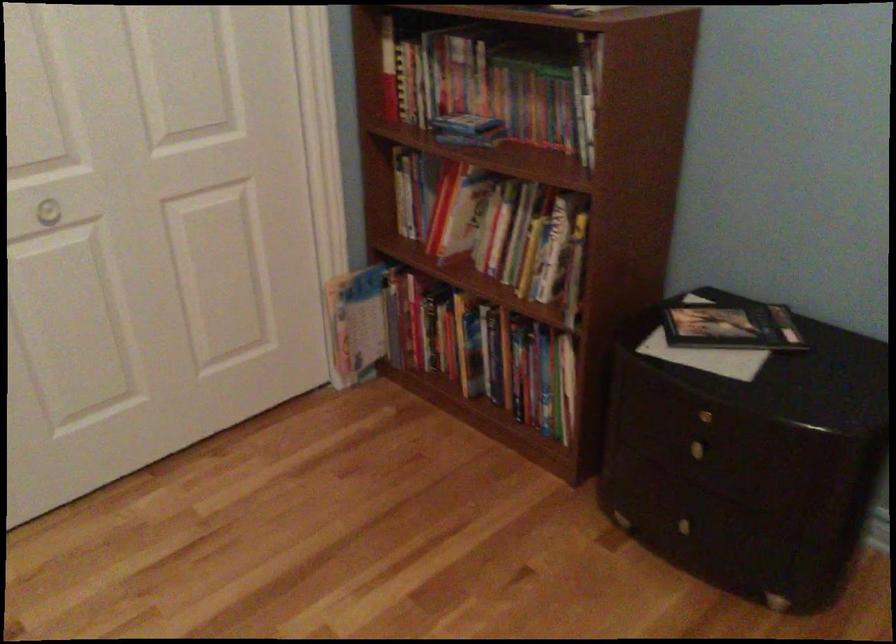
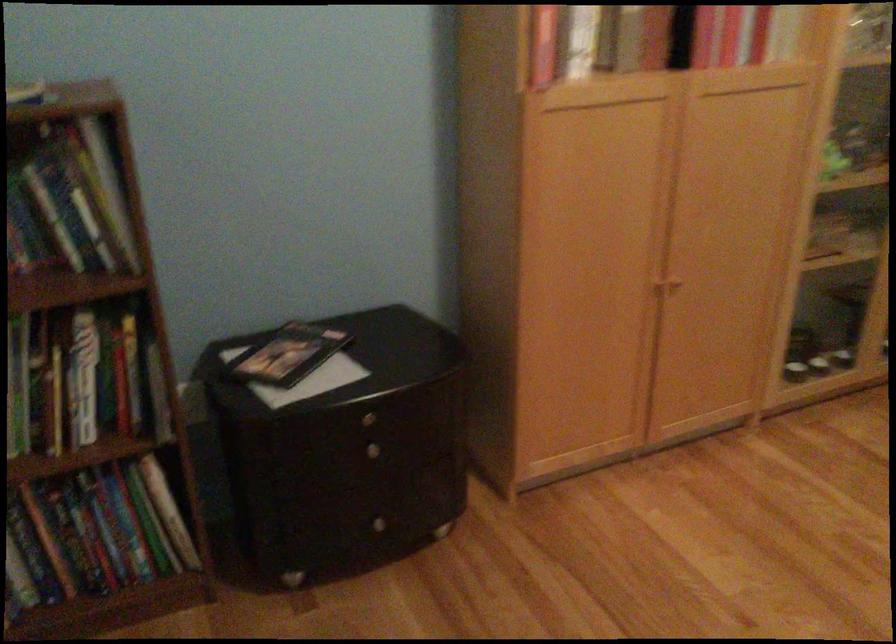
The point at (x=685, y=524) is marked in the first image. Where is the corresponding point in the second image?

(380, 524)